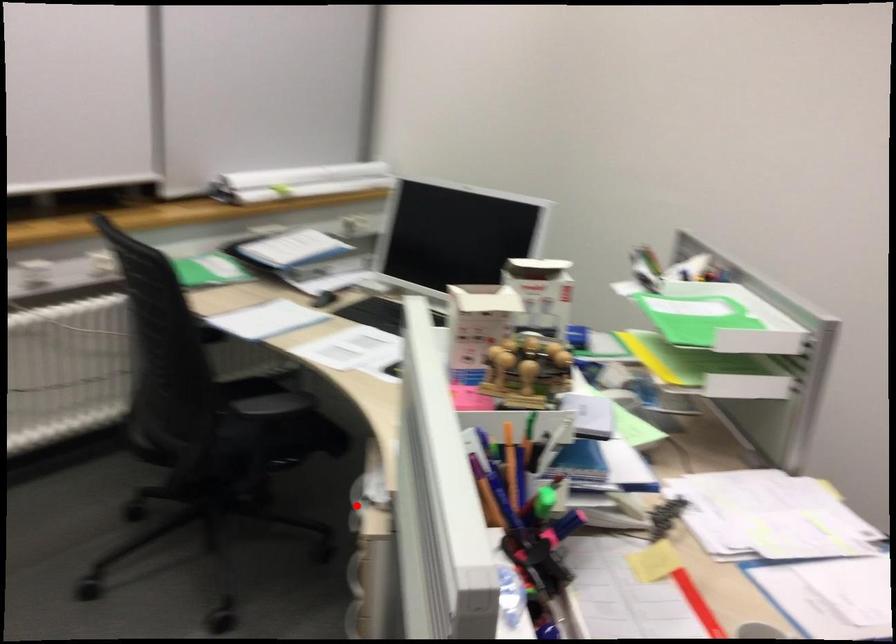
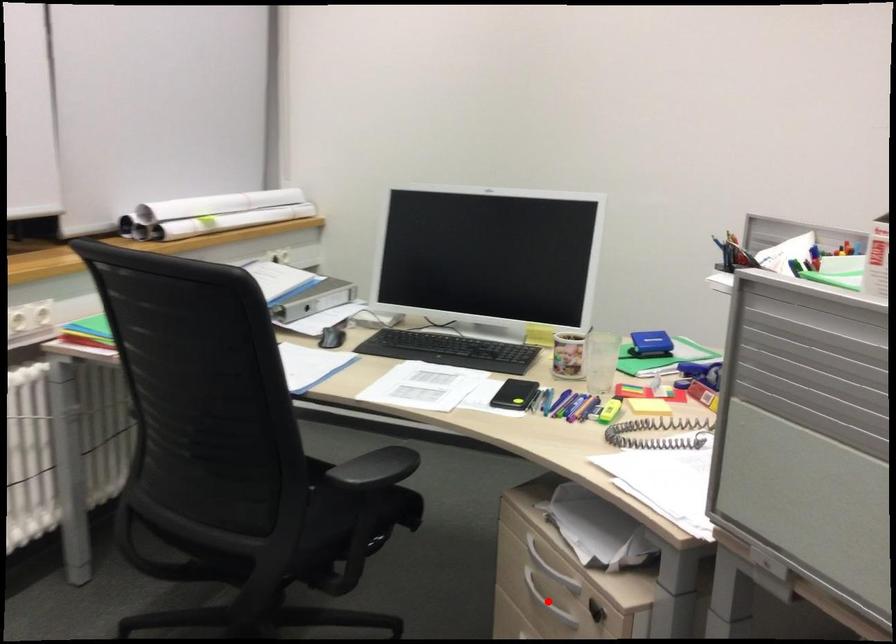
I am providing you with two images of the same scene from different viewpoints. A red point is marked on the first image and another point is marked on the second image. Is the marked point in image1 the same physical position as the marked point in image2?

No